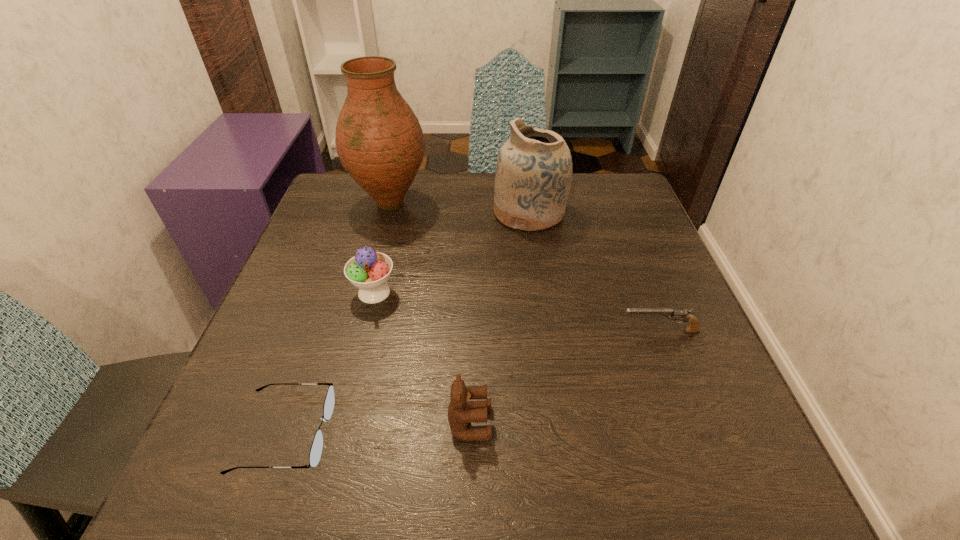
Find the location of a particular element. The height and width of the screenshot is (540, 960). vase is located at coordinates (379, 141).

Where is `the fifth shortest object`? the fifth shortest object is located at coordinates (533, 178).

Locate an element on the screen. Image resolution: width=960 pixels, height=540 pixels. pottery is located at coordinates (533, 178).

Where is `the third farthest object`? This screenshot has width=960, height=540. the third farthest object is located at coordinates (368, 270).

The width and height of the screenshot is (960, 540). I want to click on teddy bear, so click(461, 411).

Identify the location of the fifth tallest object. (693, 327).

Where is `the rightmost object`? The image size is (960, 540). the rightmost object is located at coordinates (693, 327).

Where is `the shortest object`? the shortest object is located at coordinates (315, 454).

I want to click on vacant space positioned 0.390m on the right of the tallest object, so click(581, 203).

Locate an element on the screen. The width and height of the screenshot is (960, 540). vacant space located 0.270m on the front of the pottery is located at coordinates (545, 321).